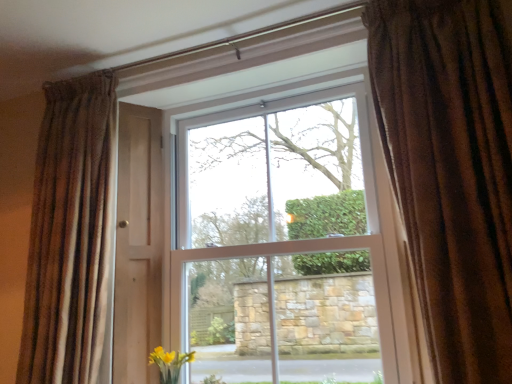
Question: Is white plastic window at center in front of or behind brown textured curtain at left, which is the 1th curtain in left-to-right order, in the image?

Choices:
 (A) behind
 (B) front

Answer: (A)

Question: Considering the positions of white plastic window at center and brown textured curtain at left, which appears as the 2th curtain when viewed from the right, in the image, is white plastic window at center taller or shorter than brown textured curtain at left, which appears as the 2th curtain when viewed from the right,?

Choices:
 (A) tall
 (B) short

Answer: (A)

Question: Considering the real-world distances, which object is farthest from the brown textured curtain at right, which ranks as the 1th curtain in front-to-back order?

Choices:
 (A) white plastic window at center
 (B) brown textured curtain at left, marked as the second curtain in a front-to-back arrangement

Answer: (B)

Question: Estimate the real-world distances between objects in this image. Which object is closer to the brown textured curtain at right, the 2th curtain when ordered from left to right?

Choices:
 (A) white plastic window at center
 (B) brown textured curtain at left, which is the 1th curtain in left-to-right order

Answer: (A)